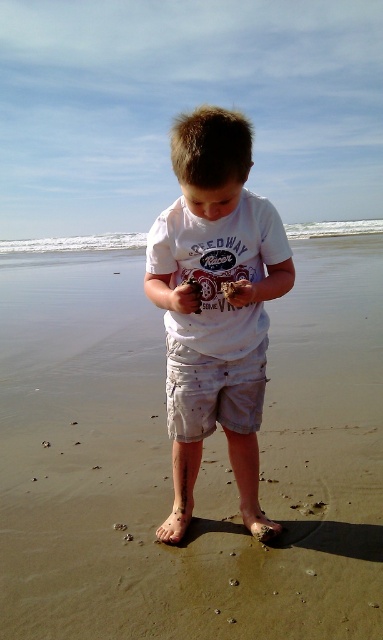
The child is holding some sand in their hands. If they want to place the sand near their shorts, which direction should they move it? The child is standing at the center of the image. The white cotton shorts at center are to the right of the matte white sand at center. So, the sand is to the left of the shorts. Therefore, to place the sand near the shorts, the child should move it to the right.

The child should move the sand to the right, as the white cotton shorts at center are located to the right of the matte white sand at center.

You are a parent trying to decide whether to put your child in a small plastic toy box. The toy box is just wide enough to fit the white cotton shirt at center. Can the white cotton shorts at center also fit inside the toy box along with the shirt?

The white cotton shirt at center might be wider than white cotton shorts at center, so there might not be enough space for both in the toy box.